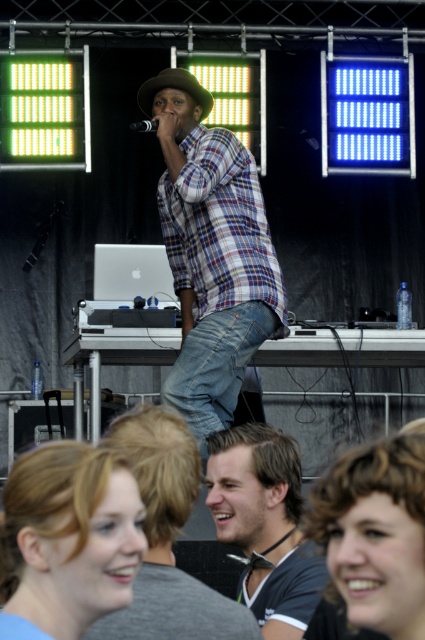
You are standing in the crowd at the live performance. You want to locate the denim jeans at center. Where would you look relative to the stage?

The denim jeans at center are located at the 2D coordinates point (215, 365), which is near the center of the stage area.